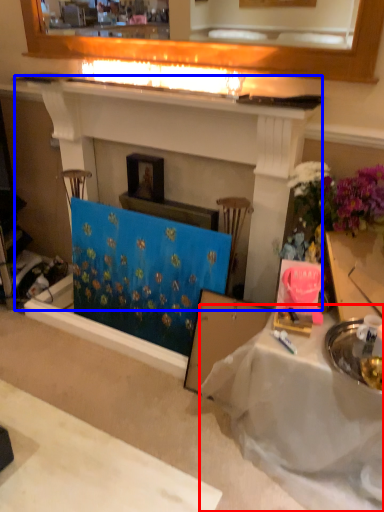
Question: Which of the following is the farthest to the observer, table (highlighted by a red box) or fireplace (highlighted by a blue box)?

Choices:
 (A) table
 (B) fireplace

Answer: (B)